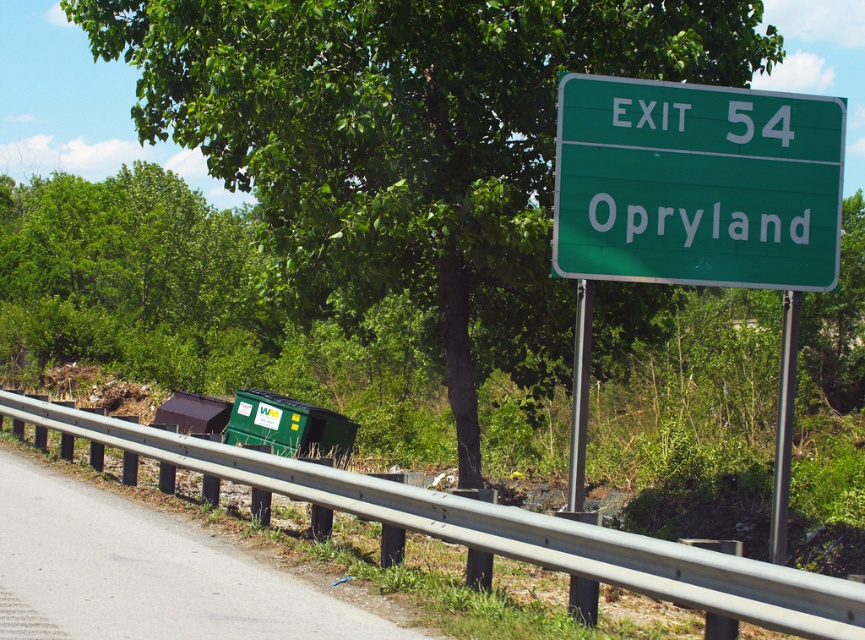
You are a driver approaching the exit sign and need to read the information on the green matte sign at upper center. Is the green leafy tree at upper center blocking your view of the sign?

The green matte sign at upper center is behind the green leafy tree at upper center, so the tree is blocking the view of the sign.

You are standing on the roadside and want to reach the trash bin located at point (x=268, y=96). The guardrail is between you and the trash bin. If the guardrail is 1.2 meters tall, can you see the trash bin over the guardrail?

The point (x=268, y=96) is 10.53 meters away from the viewer. To determine visibility over the 1.2 meter tall guardrail, we need to calculate the angle of elevation. Using trigonometry, the angle would be arctangent of height divided by distance. However, without knowing the height of the observer or the trash bin, we cannot definitively determine visibility. The question lacks sufficient data to confirm if the trash bin is visible over the guardrail.

You are a photographer standing at the roadside scene. You want to capture both the green highway exit sign and the guardrail in your photo. Which point, point [415,68] or point [783,285], is closer to the camera and should be included in the foreground?

Point [415,68] is further to the camera than point [783,285]. Therefore, point [415,68] is closer to the camera and should be included in the foreground to ensure both the exit sign and guardrail are visible.